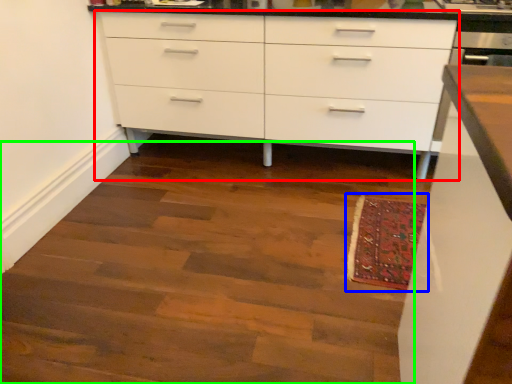
Question: Which object is positioned farthest from chest of drawers (highlighted by a red box)? Select from mat (highlighted by a blue box) and stairwell (highlighted by a green box).

Choices:
 (A) mat
 (B) stairwell

Answer: (A)